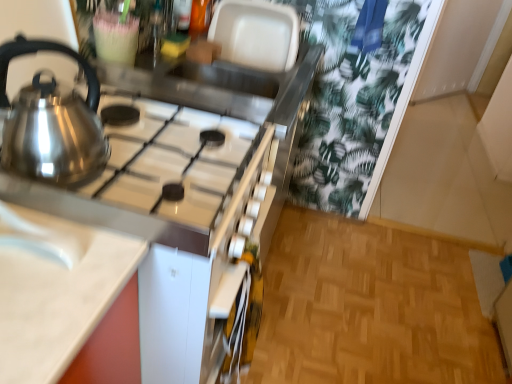
Question: Is white glossy sink at lower left directly adjacent to satin silver gas stove at upper left?

Choices:
 (A) no
 (B) yes

Answer: (A)

Question: Is white glossy sink at lower left wider than satin silver gas stove at upper left?

Choices:
 (A) yes
 (B) no

Answer: (B)

Question: Can you confirm if white glossy sink at lower left is taller than satin silver gas stove at upper left?

Choices:
 (A) no
 (B) yes

Answer: (A)

Question: Is white glossy sink at lower left not near satin silver gas stove at upper left?

Choices:
 (A) no
 (B) yes

Answer: (A)

Question: Does white glossy sink at lower left have a larger size compared to satin silver gas stove at upper left?

Choices:
 (A) yes
 (B) no

Answer: (B)

Question: In terms of width, does satin metallic kettle at left look wider or thinner when compared to white glossy sink at lower left?

Choices:
 (A) thin
 (B) wide

Answer: (A)

Question: Considering the positions of satin metallic kettle at left and white glossy sink at lower left in the image, is satin metallic kettle at left bigger or smaller than white glossy sink at lower left?

Choices:
 (A) big
 (B) small

Answer: (A)

Question: Choose the correct answer: Is satin metallic kettle at left inside white glossy sink at lower left or outside it?

Choices:
 (A) inside
 (B) outside

Answer: (B)

Question: Is satin metallic kettle at left to the left or to the right of white glossy sink at lower left in the image?

Choices:
 (A) right
 (B) left

Answer: (A)

Question: Looking at the image, does white glossy sink at lower left seem bigger or smaller compared to satin metallic kettle at left?

Choices:
 (A) big
 (B) small

Answer: (B)

Question: From a real-world perspective, is white glossy sink at lower left positioned above or below satin metallic kettle at left?

Choices:
 (A) above
 (B) below

Answer: (B)

Question: In the image, is white glossy sink at lower left positioned in front of or behind satin metallic kettle at left?

Choices:
 (A) front
 (B) behind

Answer: (A)

Question: Considering the positions of white glossy sink at lower left and satin metallic kettle at left in the image, is white glossy sink at lower left taller or shorter than satin metallic kettle at left?

Choices:
 (A) tall
 (B) short

Answer: (B)

Question: Would you say satin silver gas stove at upper left is to the left or to the right of white glossy sink at lower left in the picture?

Choices:
 (A) left
 (B) right

Answer: (B)

Question: In the image, is satin silver gas stove at upper left positioned in front of or behind white glossy sink at lower left?

Choices:
 (A) front
 (B) behind

Answer: (B)